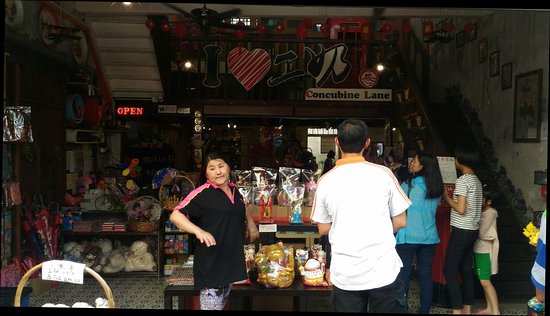
I want to click on second flight of stairs, so click(111, 50).